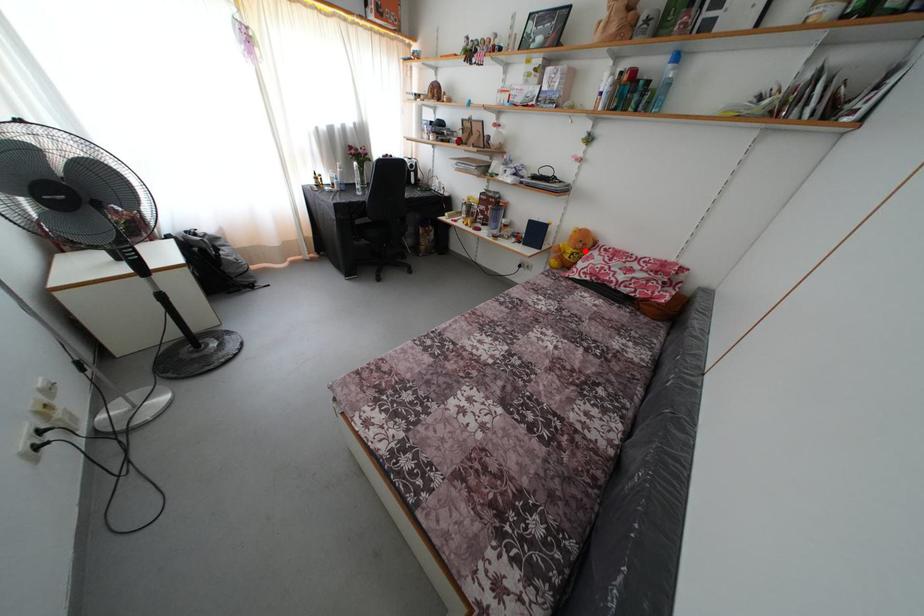
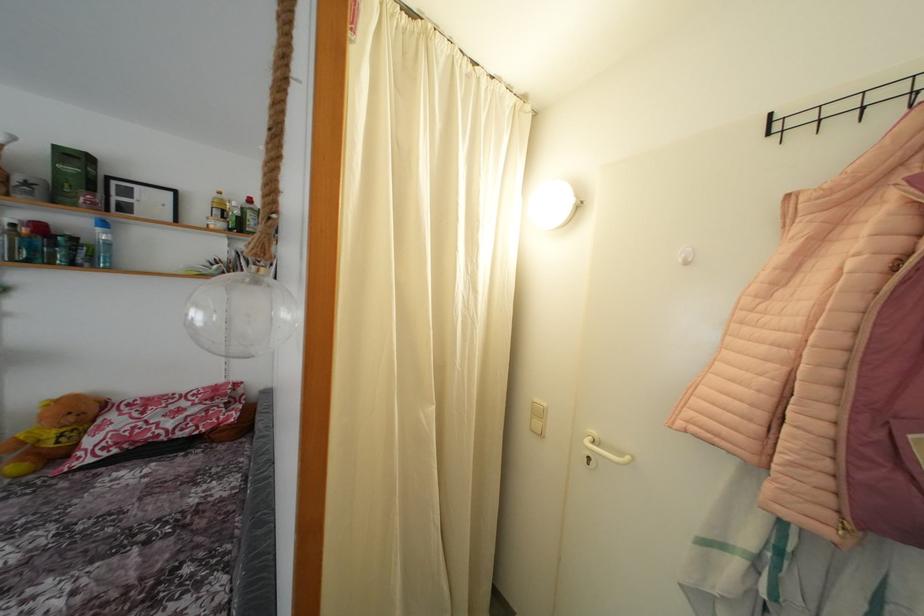
The point at the highlighted location is marked in the first image. Where is the corresponding point in the second image?

(77, 424)